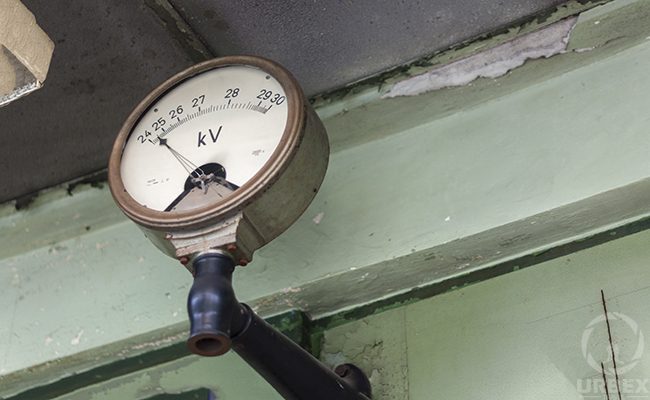
You are a GUI agent. You are given a task and a screenshot of the screen. Output one action in this format:
    pyautogui.click(x=<x>, y=<y>)
    Task: Click on the peeling paint
    The height and width of the screenshot is (400, 650).
    Given the screenshot: What is the action you would take?
    pyautogui.click(x=499, y=59)